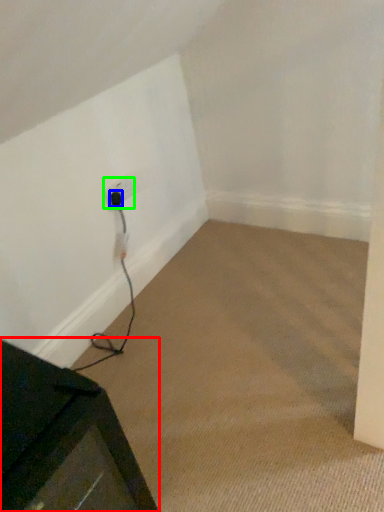
Question: Based on their relative distances, which object is nearer to furniture (highlighted by a red box)? Choose from plug (highlighted by a blue box) and electric outlet (highlighted by a green box).

Choices:
 (A) plug
 (B) electric outlet

Answer: (B)